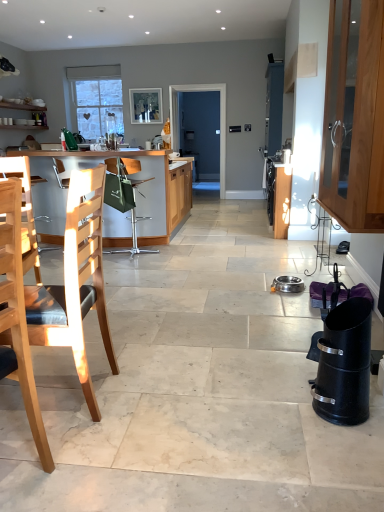
Image resolution: width=384 pixels, height=512 pixels. Identify the location of free space between black matte trash can at lower right, which is the first appliance from front to back, and light wood chair at left, the second chair viewed from the back. (206, 404).